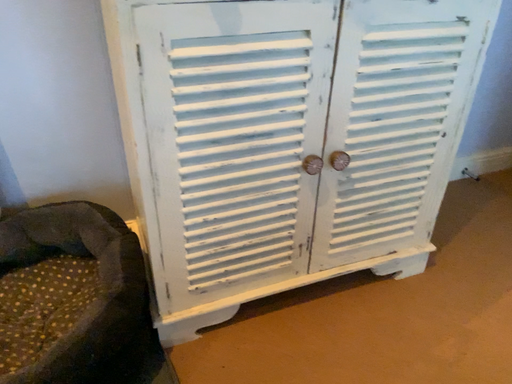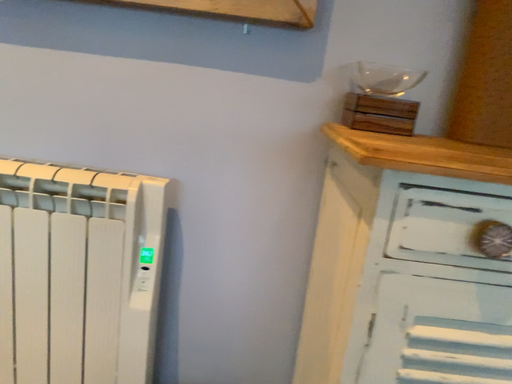
Question: How did the camera likely rotate when shooting the video?

Choices:
 (A) rotated upward
 (B) rotated downward

Answer: (A)